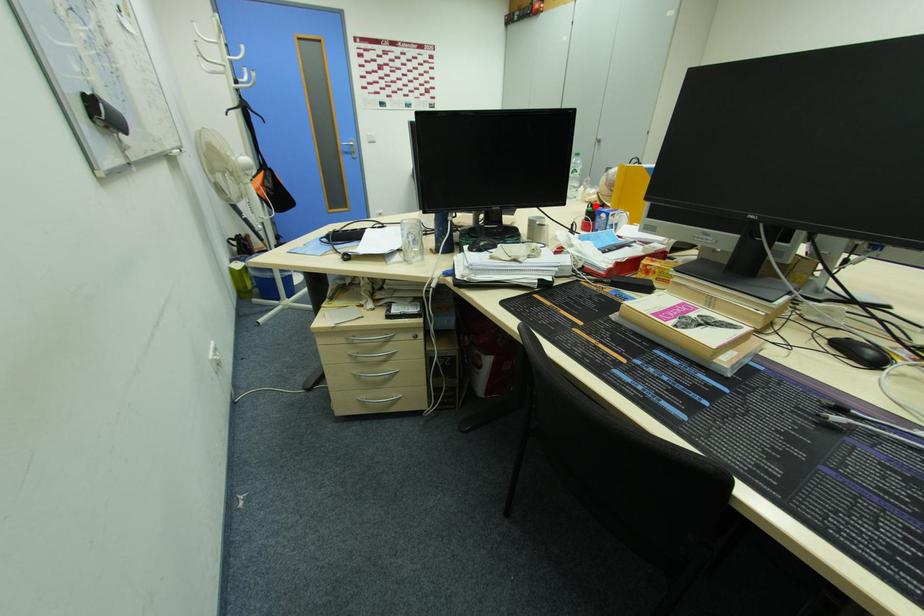
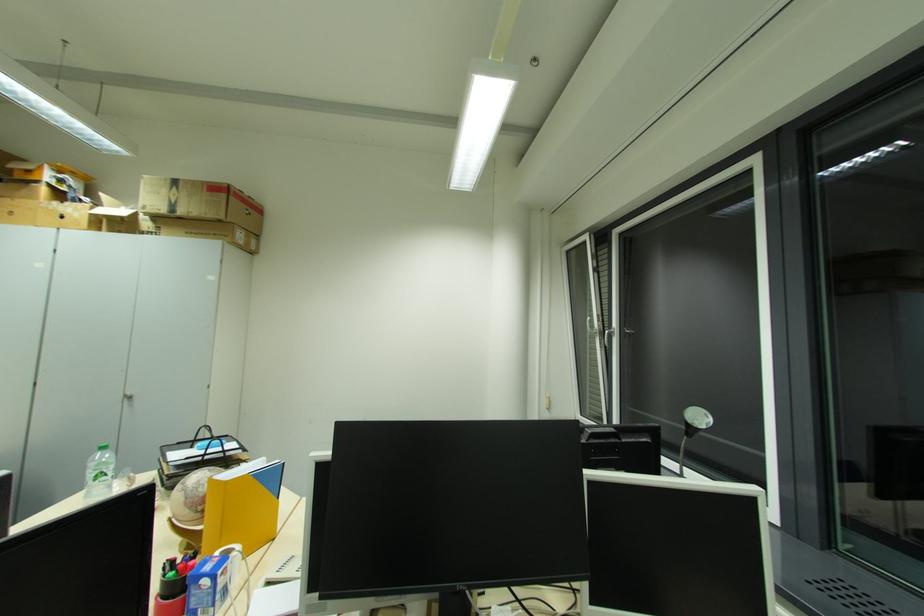
Where in the second image is the point corresponding to the highlighted location from the first image?

(176, 564)